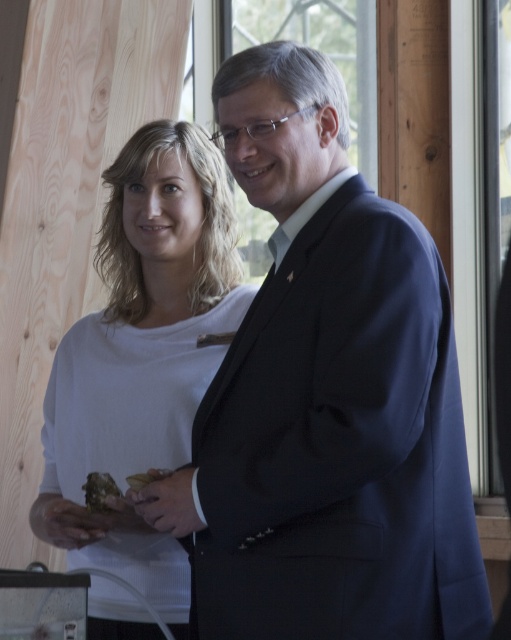
In the scene shown: Is white matte sweater at center taller than brown crumbly bread at center?

Yes.

Can you confirm if white matte sweater at center is wider than brown crumbly bread at center?

Yes, white matte sweater at center is wider than brown crumbly bread at center.

At what (x,y) coordinates should I click in order to perform the action: click on white matte sweater at center. Please return your answer as a coordinate pair (x, y). This screenshot has height=640, width=511. Looking at the image, I should click on (143, 346).

Where is `white matte sweater at center`? The width and height of the screenshot is (511, 640). white matte sweater at center is located at coordinates (143, 346).

Is matte brown bread at center positioned before brown crumbly bread at center?

No, matte brown bread at center is behind brown crumbly bread at center.

What do you see at coordinates (99, 490) in the screenshot?
I see `matte brown bread at center` at bounding box center [99, 490].

This screenshot has height=640, width=511. Identify the location of matte brown bread at center. (99, 490).

The height and width of the screenshot is (640, 511). Identify the location of matte brown bread at center. (99, 490).

Measure the distance from dark blue suit at center to matte brown bread at center.

dark blue suit at center and matte brown bread at center are 28.55 inches apart from each other.

Consider the image. Does dark blue suit at center have a greater width compared to matte brown bread at center?

Yes.

Is point (230, 499) positioned before point (94, 484)?

Yes.

The height and width of the screenshot is (640, 511). Identify the location of dark blue suit at center. (327, 397).